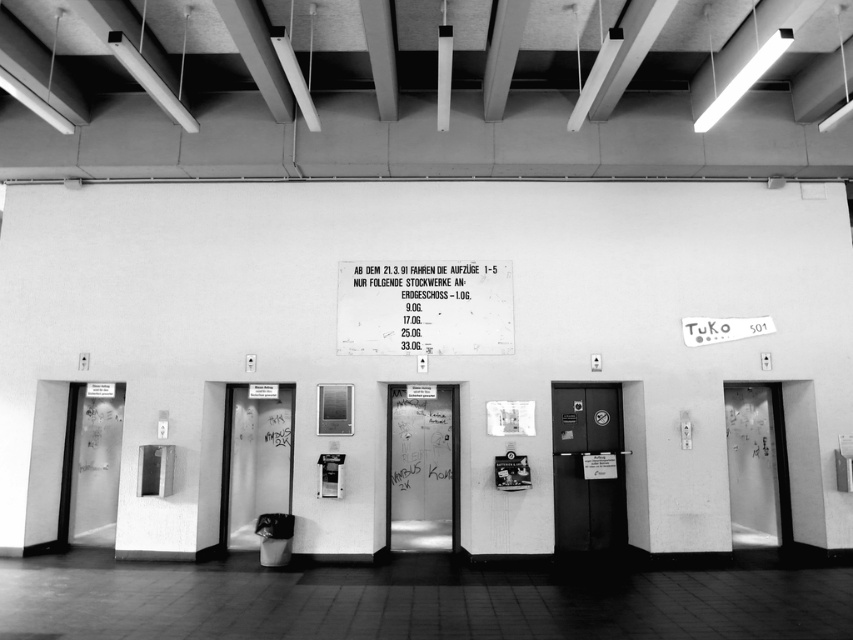
Consider the image. You are standing in the hallway and need to find the metallic sign at center. According to the scene description, where should you look to locate it?

The metallic sign at center is located at point [424,308] in the image coordinates, so you should look towards the center of the image to find it.

You are standing in the hallway shown in the image. There is a point marked at coordinates point (598,243). Can you estimate how far this point is from your current position?

The point (598,243) is 31.55 feet away from the viewer.